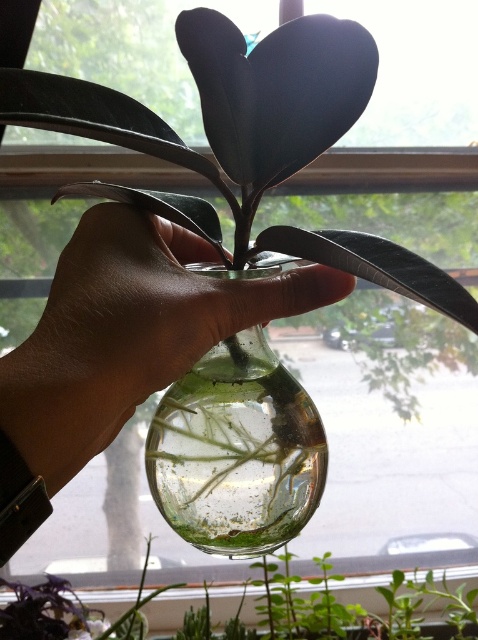
Question: Which of the following is the farthest from the observer?

Choices:
 (A) transparent glass vase at center
 (B) clear glass vase at center

Answer: (B)

Question: Can you confirm if transparent glass vase at center is positioned to the right of clear glass vase at center?

Choices:
 (A) no
 (B) yes

Answer: (B)

Question: Which of the following is the farthest from the observer?

Choices:
 (A) clear glass vase at center
 (B) transparent glass vase at center
 (C) transparent glass hand at center

Answer: (A)

Question: Can you confirm if transparent glass hand at center is positioned above transparent glass vase at center?

Choices:
 (A) no
 (B) yes

Answer: (B)

Question: Which object is the farthest from the clear glass vase at center?

Choices:
 (A) transparent glass vase at center
 (B) transparent glass hand at center

Answer: (B)

Question: Can you confirm if transparent glass vase at center is positioned to the left of clear glass vase at center?

Choices:
 (A) yes
 (B) no

Answer: (B)